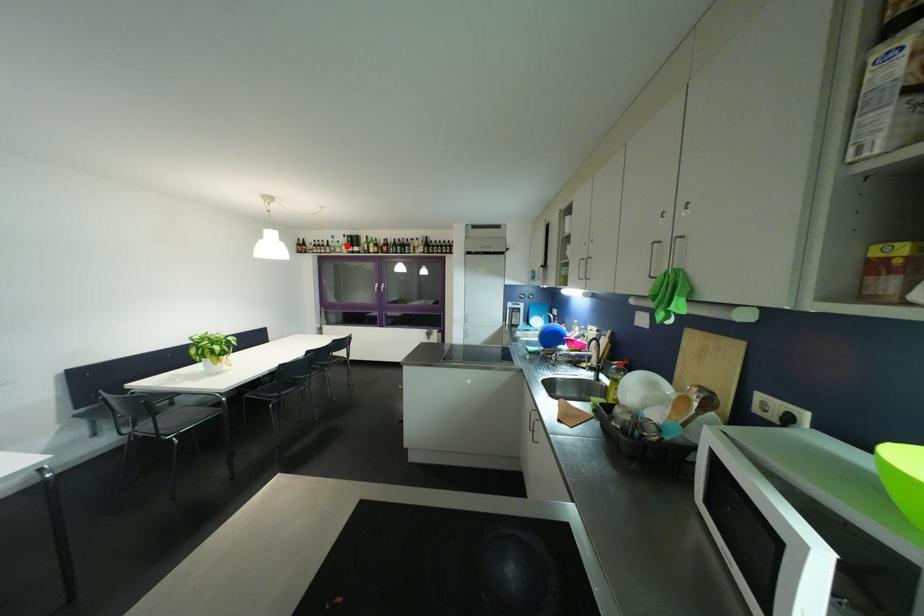
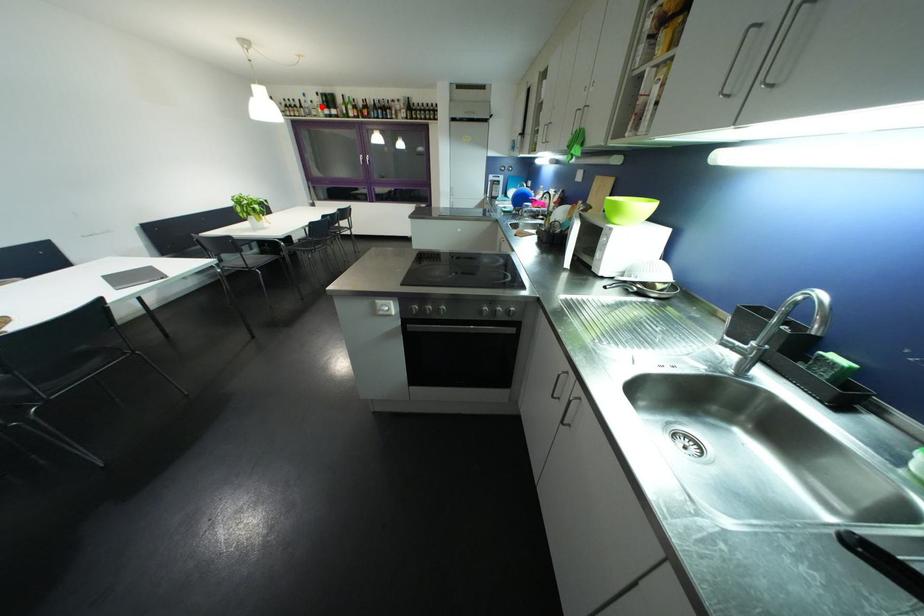
I am providing you with two images of the same scene from different viewpoints. A red point is marked on the first image and another point is marked on the second image. Is the red point in image1 aligned with the point shown in image2?

Yes